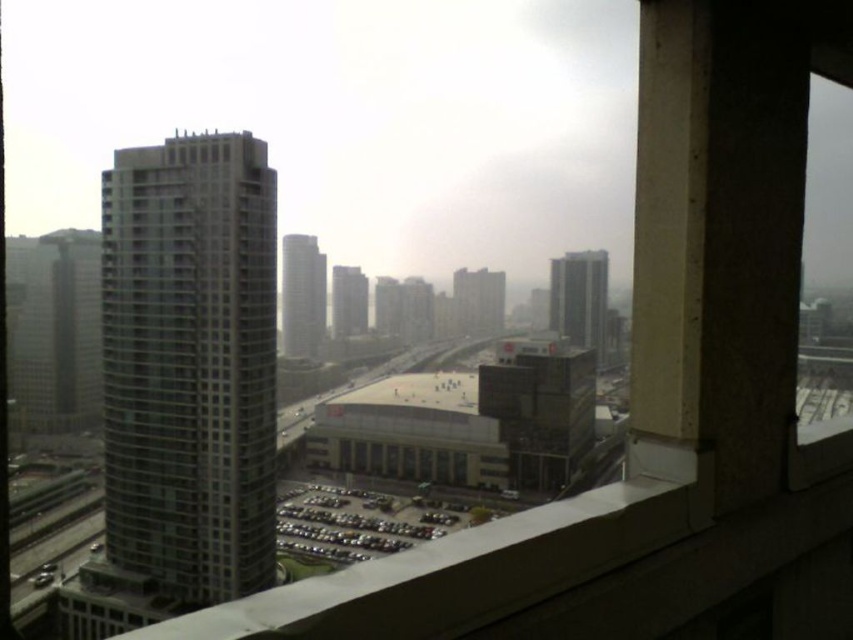
You are standing inside the building and looking out the window. You notice the glassy gray tower at left. Can you determine its exact position relative to the window frame?

The glassy gray tower at left is located at point 0.570 on the x axis and 0.224 on the y axis relative to the window frame.

You are standing inside the building and looking through the window. There is a point marked at coordinates (x=190, y=364). What does this point indicate?

The point at (x=190, y=364) marks the glassy gray tower at left.

From the picture: You are standing inside a room and looking through the window. You see two buildings outside. Which one is positioned to the right of the other? The matte glass building at center and the glassy reflective skyscraper at center.

The matte glass building at center is to the right of the glassy reflective skyscraper at center.